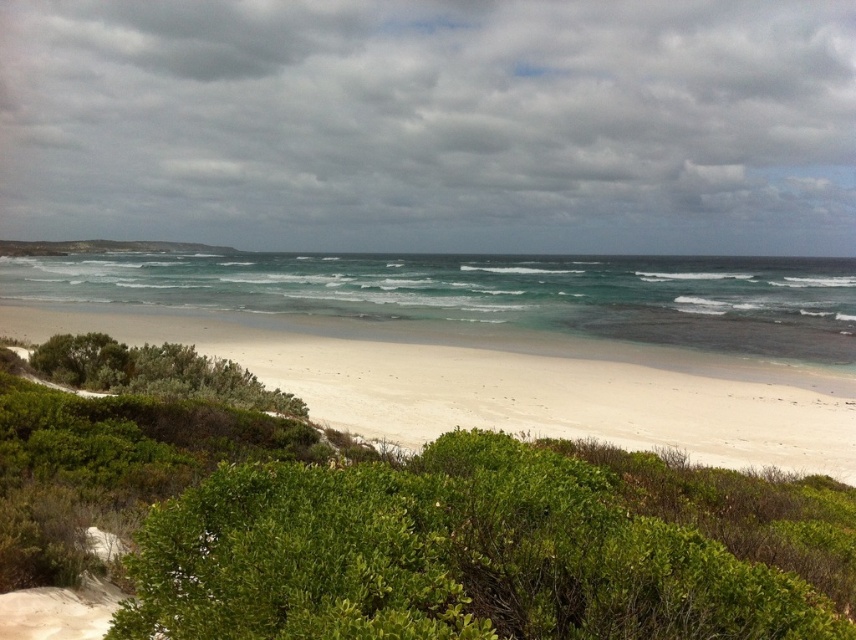
Does green leafy bush at lower center appear on the right side of clear blue water at center?

Indeed, green leafy bush at lower center is positioned on the right side of clear blue water at center.

How much distance is there between green leafy bush at lower center and clear blue water at center?

green leafy bush at lower center and clear blue water at center are 112.39 meters apart.

Which is in front, point (397, 497) or point (440, 282)?

Positioned in front is point (397, 497).

Locate an element on the screen. green leafy bush at lower center is located at coordinates (495, 548).

Between green leafy bush at lower center and white sandy beach at center, which one is positioned lower?

green leafy bush at lower center is lower down.

Does green leafy bush at lower center appear under white sandy beach at center?

Yes.

Measure the distance between green leafy bush at lower center and camera.

green leafy bush at lower center is 4.47 meters away from camera.

The height and width of the screenshot is (640, 856). What are the coordinates of `green leafy bush at lower center` in the screenshot? It's located at (495, 548).

Which is more to the left, clear blue water at center or white sandy beach at center?

From the viewer's perspective, white sandy beach at center appears more on the left side.

Is clear blue water at center to the left of white sandy beach at center from the viewer's perspective?

In fact, clear blue water at center is to the right of white sandy beach at center.

The width and height of the screenshot is (856, 640). What do you see at coordinates (480, 296) in the screenshot?
I see `clear blue water at center` at bounding box center [480, 296].

Where is `clear blue water at center`? clear blue water at center is located at coordinates (480, 296).